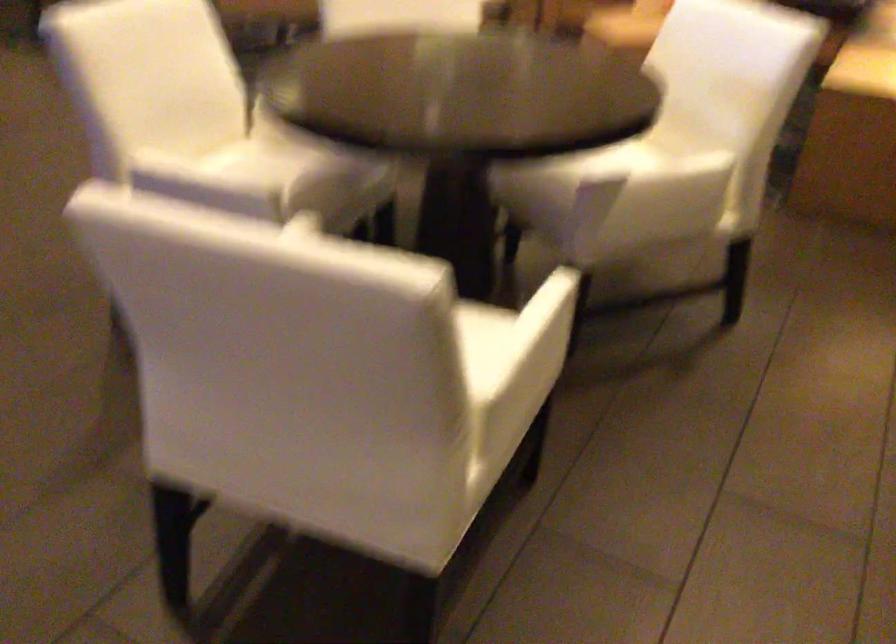
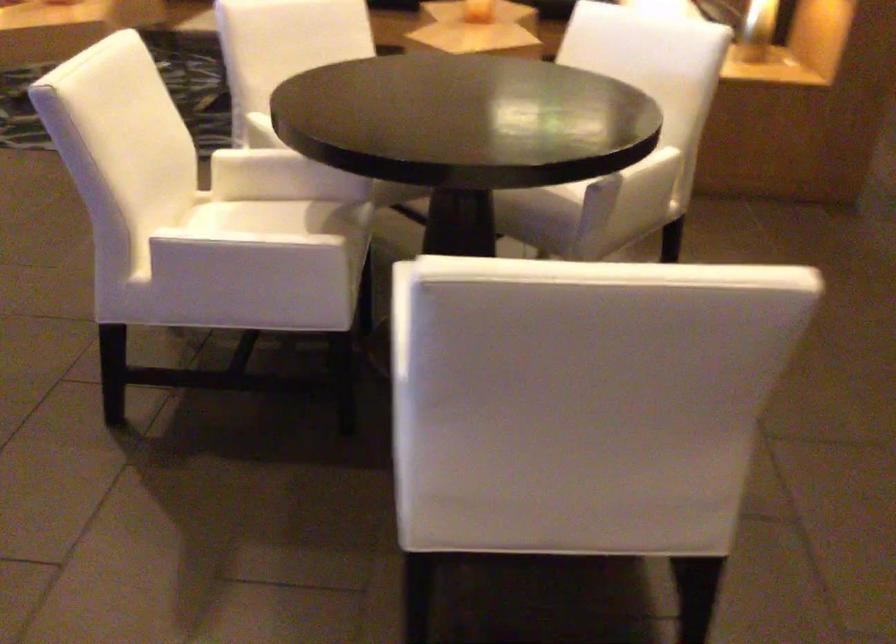
Find the pixel in the second image that matches (x=328, y=196) in the first image.

(347, 240)